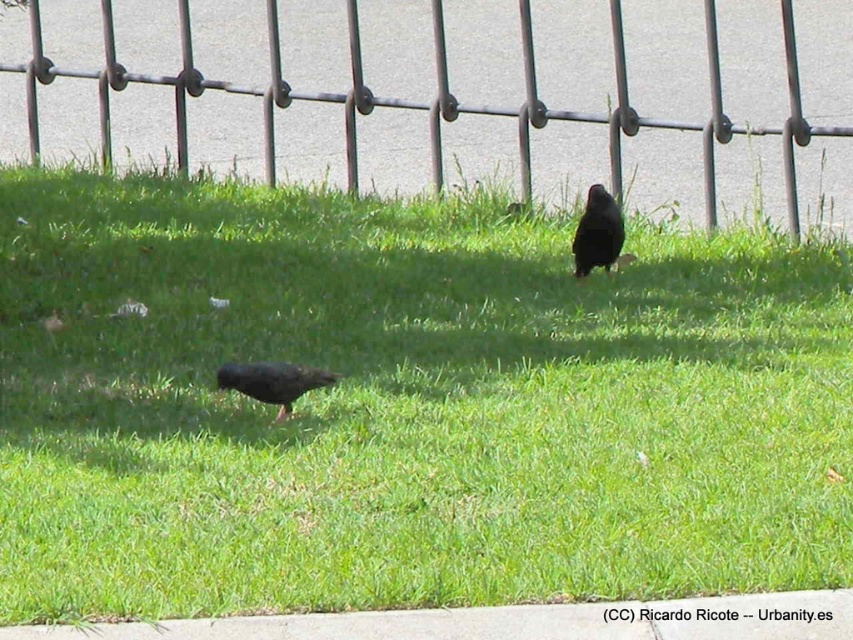
In the scene shown: Does shiny black bird at center appear on the right side of shiny black bird at upper center?

Result: In fact, shiny black bird at center is to the left of shiny black bird at upper center.

What do you see at coordinates (271, 381) in the screenshot?
I see `shiny black bird at center` at bounding box center [271, 381].

Identify the location of shiny black bird at center. The height and width of the screenshot is (640, 853). (271, 381).

Can you confirm if metallic wire fence at upper center is shorter than shiny black bird at center?

Incorrect, metallic wire fence at upper center's height does not fall short of shiny black bird at center's.

Looking at this image, which is below, metallic wire fence at upper center or shiny black bird at center?

shiny black bird at center is below.

The height and width of the screenshot is (640, 853). Describe the element at coordinates (433, 97) in the screenshot. I see `metallic wire fence at upper center` at that location.

Where is `metallic wire fence at upper center`? This screenshot has width=853, height=640. metallic wire fence at upper center is located at coordinates (433, 97).

Who is more forward, (780, 138) or (607, 266)?

Point (607, 266)

Where is `metallic wire fence at upper center`? metallic wire fence at upper center is located at coordinates (433, 97).